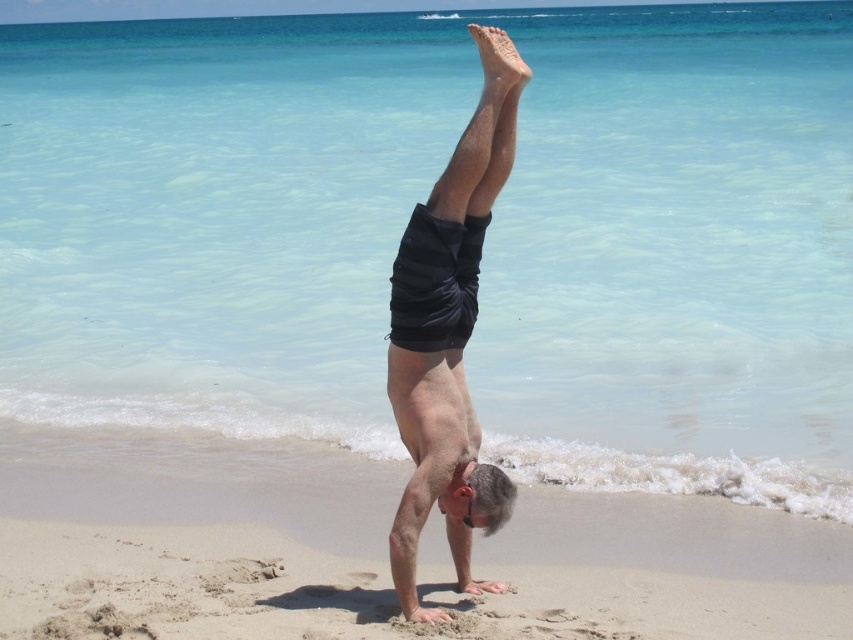
Is beige sandy beach at center shorter than black striped shorts at center?

Correct, beige sandy beach at center is not as tall as black striped shorts at center.

Is beige sandy beach at center to the right of black striped shorts at center from the viewer's perspective?

A: No, beige sandy beach at center is not to the right of black striped shorts at center.

Identify the location of beige sandy beach at center. (186, 513).

Locate an element on the screen. This screenshot has width=853, height=640. beige sandy beach at center is located at coordinates (186, 513).